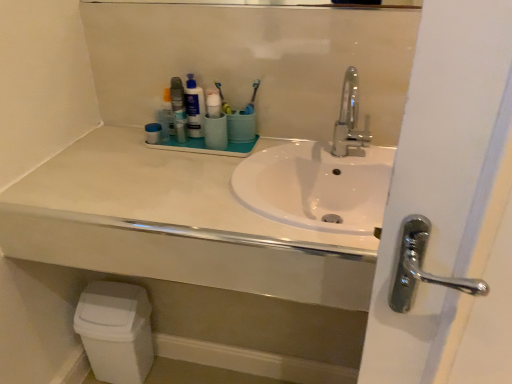
What are the coordinates of `vacant area that is in front of matte plastic container at upper center, which is counted as the 3th toiletry, starting from the right` in the screenshot? It's located at (144, 162).